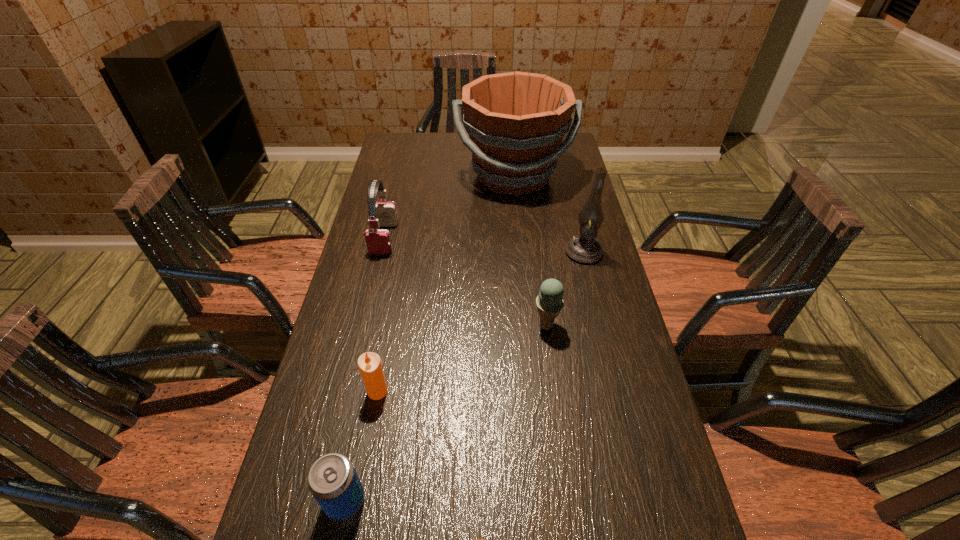
Image resolution: width=960 pixels, height=540 pixels. I want to click on vacant space that satisfies the following two spatial constraints: 1. on the outer surface of the fifth farthest object; 2. on the left side of the third tallest object, so click(348, 392).

Image resolution: width=960 pixels, height=540 pixels. In order to click on vacant space that satisfies the following two spatial constraints: 1. on the handle side of the oil lamp; 2. on the left side of the farthest object in this screenshot , I will do `click(520, 252)`.